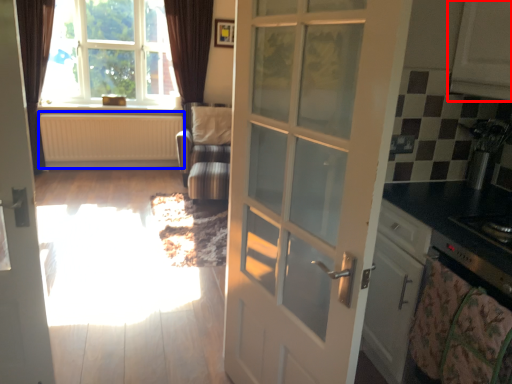
Question: Which object is closer to the camera taking this photo, cabinetry (highlighted by a red box) or radiator (highlighted by a blue box)?

Choices:
 (A) cabinetry
 (B) radiator

Answer: (A)